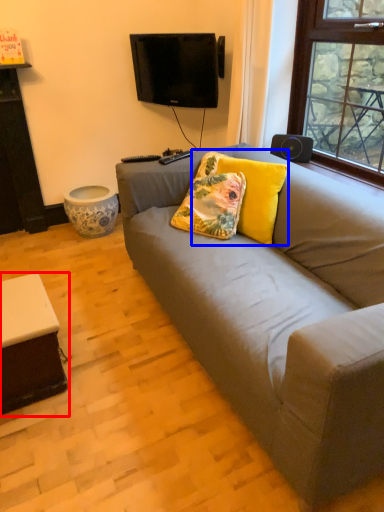
Question: Which object is closer to the camera taking this photo, table (highlighted by a red box) or pillow (highlighted by a blue box)?

Choices:
 (A) table
 (B) pillow

Answer: (A)